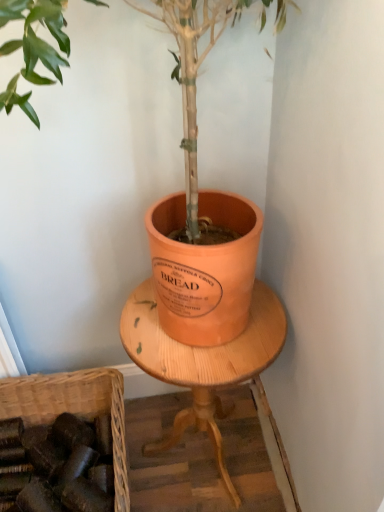
Measure the distance between wooden round table at center and camera.

wooden round table at center is 33.01 inches from camera.

In order to face matte orange pot at center, should I rotate leftwards or rightwards?

Turn left approximately 3.290 degrees to face it.

Where is `brown woven basket at lower left`? Image resolution: width=384 pixels, height=512 pixels. brown woven basket at lower left is located at coordinates (73, 408).

The height and width of the screenshot is (512, 384). In order to click on wooden round table at center in this screenshot , I will do tap(202, 361).

Is brown woven basket at lower left inside matte orange pot at center?

No, brown woven basket at lower left is not surrounded by matte orange pot at center.

What's the angular difference between matte orange pot at center and brown woven basket at lower left's facing directions?

They differ by 2.06 degrees in their facing directions.

Considering the points (58, 229) and (127, 495), which point is in front, point (58, 229) or point (127, 495)?

The point (127, 495) is closer to the camera.

How different are the orientations of matte orange pot at center and wooden round table at center in degrees?

matte orange pot at center and wooden round table at center are facing 0.283 degrees away from each other.

Is matte orange pot at center completely or partially outside of wooden round table at center?

Yes, matte orange pot at center is located beyond the bounds of wooden round table at center.

Who is bigger, matte orange pot at center or wooden round table at center?

matte orange pot at center is bigger.

Based on their positions, is matte orange pot at center located to the left or right of wooden round table at center?

Clearly, matte orange pot at center is on the left of wooden round table at center in the image.

Is brown woven basket at lower left with wooden round table at center?

No.

Is wooden round table at center at the back of brown woven basket at lower left?

No, brown woven basket at lower left is not facing away from wooden round table at center.

Find the location of a particular element. The image size is (384, 512). round table located above the brown woven basket at lower left (from a real-world perspective) is located at coordinates (202, 361).

Is wooden round table at center wider than brown woven basket at lower left?

No, wooden round table at center is not wider than brown woven basket at lower left.

From a real-world perspective, is wooden round table at center on brown woven basket at lower left?

Indeed, from a real-world perspective, wooden round table at center stands above brown woven basket at lower left.

In the scene shown: Is wooden round table at center positioned beyond the bounds of brown woven basket at lower left?

Yes, wooden round table at center is not within brown woven basket at lower left.

Is wooden round table at center far away from brown woven basket at lower left?

No, there isn't a large distance between wooden round table at center and brown woven basket at lower left.

Which of these two, wooden round table at center or matte orange pot at center, is bigger?

matte orange pot at center.

Which point is more distant from viewer, (165, 444) or (201, 193)?

Positioned behind is point (165, 444).

Consider the image. Is wooden round table at center oriented away from matte orange pot at center?

No, matte orange pot at center is not at the back of wooden round table at center.

Can you confirm if wooden round table at center is wider than matte orange pot at center?

No.

Considering the relative positions of brown woven basket at lower left and matte orange pot at center in the image provided, is brown woven basket at lower left in front of matte orange pot at center?

No, the depth of brown woven basket at lower left is greater than that of matte orange pot at center.

Is brown woven basket at lower left inside the boundaries of matte orange pot at center, or outside?

brown woven basket at lower left is spatially situated outside matte orange pot at center.

Locate an element on the screen. The height and width of the screenshot is (512, 384). houseplant located on the right of brown woven basket at lower left is located at coordinates (128, 181).

Locate an element on the screen. basket behind the matte orange pot at center is located at coordinates (73, 408).

You are a GUI agent. You are given a task and a screenshot of the screen. Output one action in this format:
    pyautogui.click(x=<x>, y=<y>)
    Task: Click on the houseplant above the wooden round table at center (from the image's perspective)
    This screenshot has height=512, width=384.
    Given the screenshot: What is the action you would take?
    pyautogui.click(x=128, y=181)

When comparing their distances from brown woven basket at lower left, does matte orange pot at center or wooden round table at center seem closer?

wooden round table at center.

Estimate the real-world distances between objects in this image. Which object is closer to brown woven basket at lower left, wooden round table at center or matte orange pot at center?

wooden round table at center is closer to brown woven basket at lower left.

When comparing their distances from wooden round table at center, does brown woven basket at lower left or matte orange pot at center seem closer?

The object closer to wooden round table at center is matte orange pot at center.

When comparing their distances from wooden round table at center, does matte orange pot at center or brown woven basket at lower left seem closer?

The object closer to wooden round table at center is matte orange pot at center.

Based on their spatial positions, is brown woven basket at lower left or wooden round table at center further from matte orange pot at center?

Based on the image, brown woven basket at lower left appears to be further to matte orange pot at center.

Estimate the real-world distances between objects in this image. Which object is closer to matte orange pot at center, wooden round table at center or brown woven basket at lower left?

The object closer to matte orange pot at center is wooden round table at center.

Find the location of a particular element. The height and width of the screenshot is (512, 384). round table that lies between matte orange pot at center and brown woven basket at lower left from top to bottom is located at coordinates (202, 361).